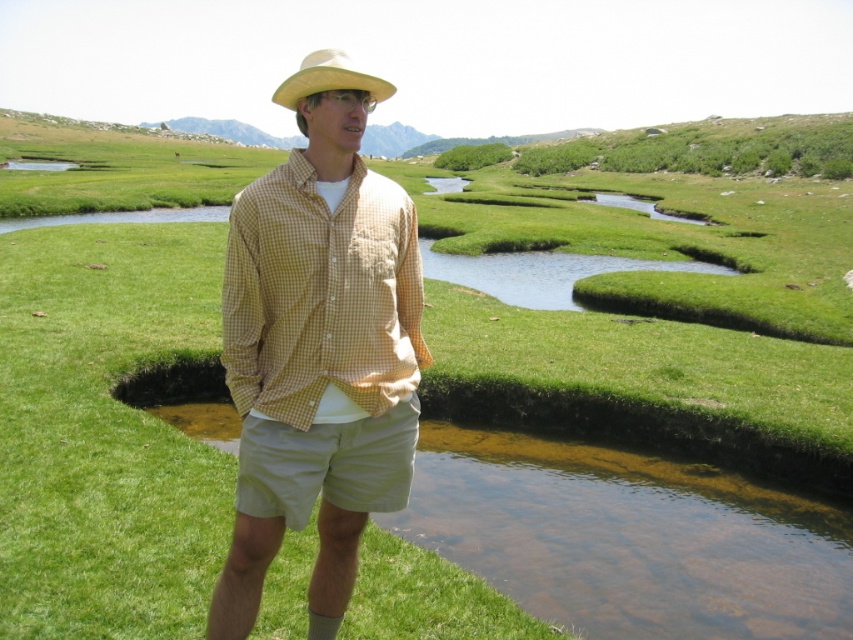
Can you confirm if matte yellow hat at center is thinner than khaki cotton shorts at center?

In fact, matte yellow hat at center might be wider than khaki cotton shorts at center.

Measure the distance from matte yellow hat at center to khaki cotton shorts at center.

They are 5.18 inches apart.

I want to click on matte yellow hat at center, so click(318, 348).

Does yellow checkered shirt at center have a greater width compared to yellow straw hat at upper center?

No.

In the scene shown: Is yellow checkered shirt at center shorter than yellow straw hat at upper center?

Indeed, yellow checkered shirt at center has a lesser height compared to yellow straw hat at upper center.

Does point (317, 362) come farther from viewer compared to point (300, 81)?

That is True.

This screenshot has height=640, width=853. I want to click on yellow checkered shirt at center, so click(320, 294).

Is khaki cotton shorts at center in front of yellow straw hat at upper center?

That is True.

Who is more distant from viewer, (409, 413) or (345, 80)?

Positioned behind is point (409, 413).

Between point (340, 436) and point (303, 90), which one is positioned behind?

Positioned behind is point (340, 436).

Where is `khaki cotton shorts at center`? This screenshot has width=853, height=640. khaki cotton shorts at center is located at coordinates (326, 465).